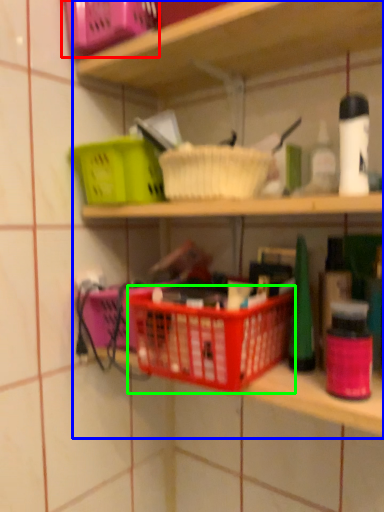
Question: Which object is the closest to the basket (highlighted by a red box)? Choose among these: shelf (highlighted by a blue box) or basket container (highlighted by a green box).

Choices:
 (A) shelf
 (B) basket container

Answer: (A)